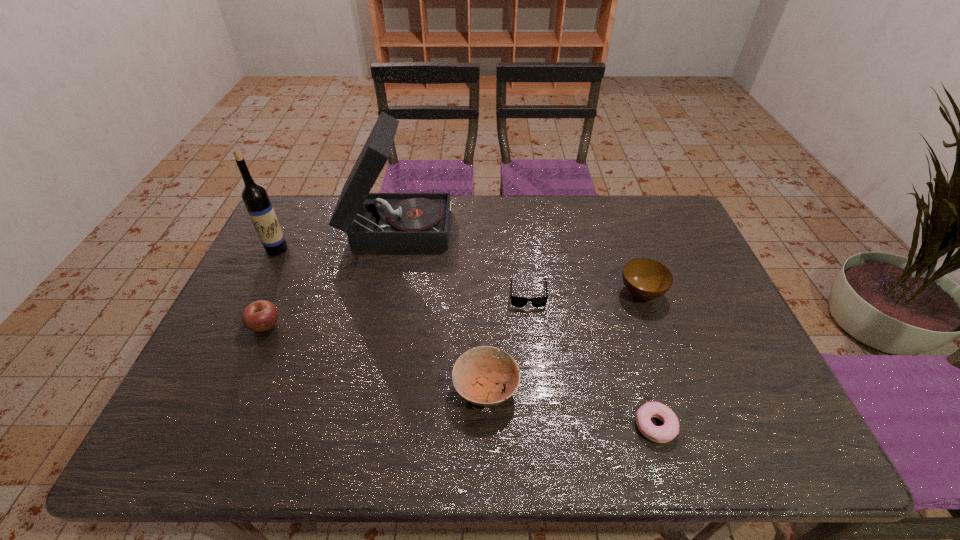
Find the location of a particular element. The image size is (960, 540). the fifth object from right to left is located at coordinates (373, 221).

The image size is (960, 540). Find the location of `wine bottle`. wine bottle is located at coordinates (260, 210).

At what (x,y) coordinates should I click in order to perform the action: click on the farther bowl. Please return your answer as a coordinate pair (x, y). This screenshot has width=960, height=540. Looking at the image, I should click on (646, 279).

Image resolution: width=960 pixels, height=540 pixels. Identify the location of the fifth farthest object. (259, 316).

This screenshot has height=540, width=960. Find the location of `the nearer bowl`. the nearer bowl is located at coordinates (476, 373).

Where is `the second shortest object`? Image resolution: width=960 pixels, height=540 pixels. the second shortest object is located at coordinates (516, 301).

Where is `doughnut`? doughnut is located at coordinates (660, 434).

Find the location of `free space located 0.260m on the front-facing side of the third object from left to right`. free space located 0.260m on the front-facing side of the third object from left to right is located at coordinates (527, 223).

At what (x,y) coordinates should I click in order to perform the action: click on vacant space located on the label of the wine bottle. Please return your answer as a coordinate pair (x, y). This screenshot has height=540, width=960. Looking at the image, I should click on (252, 301).

Locate an element on the screen. vacant area situated 0.300m on the back of the farther bowl is located at coordinates (613, 216).